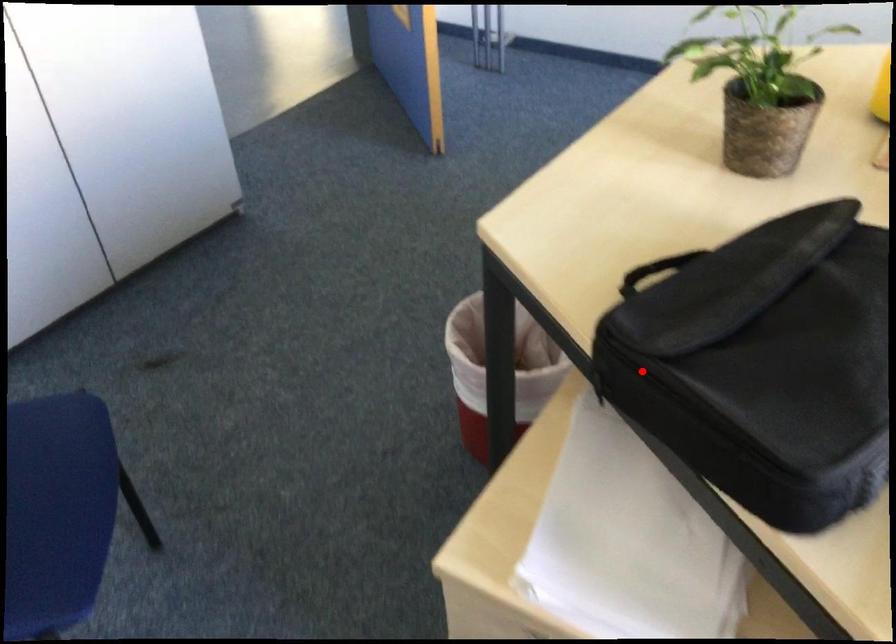
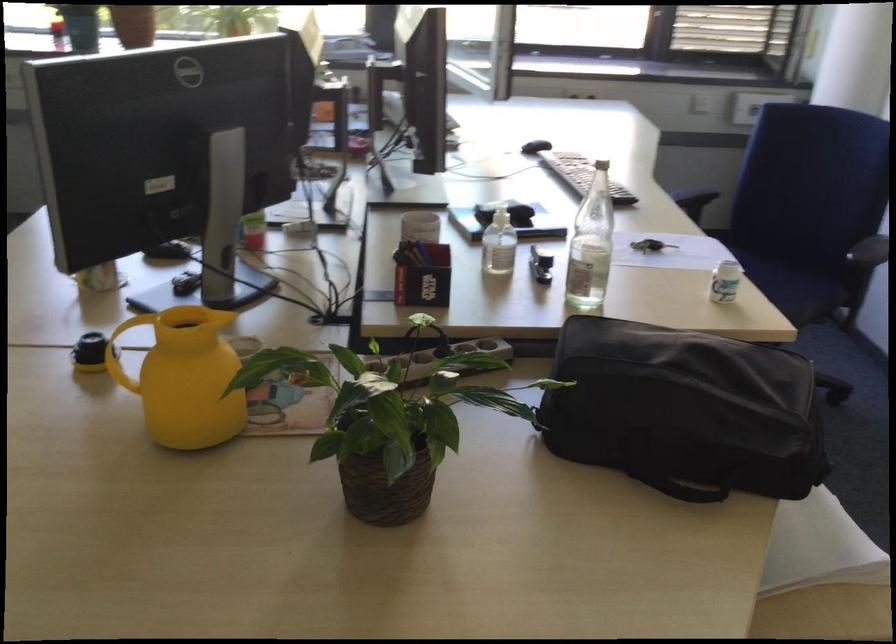
Question: I am providing you with two images of the same scene from different viewpoints. Given a red point in image1, look at the same physical point in image2. Is it:

Choices:
 (A) Closer to the viewpoint
 (B) Farther from the viewpoint

Answer: (B)